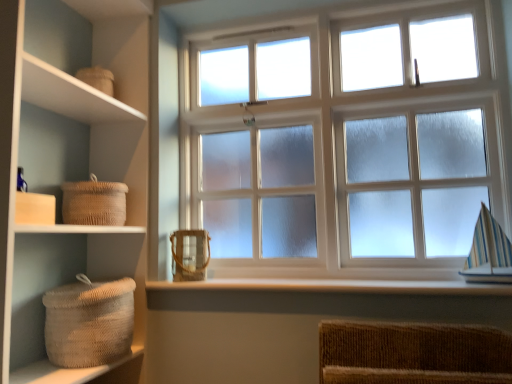
Describe the element at coordinates (94, 202) in the screenshot. I see `woven natural fiber basket at left, acting as the 3th basket starting from the bottom` at that location.

In order to face woven natural fiber basket at left, which is the 1th basket from top to bottom, should I rotate leftwards or rightwards?

Rotate your view left by about 20.331°.

What do you see at coordinates (67, 173) in the screenshot? This screenshot has width=512, height=384. I see `beige woven basket at left` at bounding box center [67, 173].

At what (x,y) coordinates should I click in order to perform the action: click on frosted glass window at center. Please return your answer as a coordinate pair (x, y). This screenshot has width=512, height=384. Looking at the image, I should click on (354, 146).

Consider the image. Considering the sizes of objects brown woven basket at center, which is the second basket from top to bottom, and white smooth wood at lower center in the image provided, who is smaller, brown woven basket at center, which is the second basket from top to bottom, or white smooth wood at lower center?

With smaller size is brown woven basket at center, which is the second basket from top to bottom.

From a real-world perspective, who is located lower, brown woven basket at center, which is counted as the second basket, starting from the bottom, or white smooth wood at lower center?

white smooth wood at lower center, from a real-world perspective.

Could you tell me if brown woven basket at center, which is the second basket from top to bottom, is facing white smooth wood at lower center?

No, brown woven basket at center, which is the second basket from top to bottom, is not aimed at white smooth wood at lower center.

Which is more to the right, brown woven basket at center, which is counted as the second basket, starting from the bottom, or white smooth wood at lower center?

From the viewer's perspective, white smooth wood at lower center appears more on the right side.

Considering the relative sizes of beige woven basket at left and brown woven basket at center, which is the second basket from top to bottom, in the image provided, is beige woven basket at left shorter than brown woven basket at center, which is the second basket from top to bottom,?

No, beige woven basket at left is not shorter than brown woven basket at center, which is the second basket from top to bottom.

Are beige woven basket at left and brown woven basket at center, which is the second basket from top to bottom, located far from each other?

beige woven basket at left is near brown woven basket at center, which is the second basket from top to bottom, not far away.

From the image's perspective, is beige woven basket at left over brown woven basket at center, which is counted as the second basket, starting from the bottom?

Yes, from the image's perspective, beige woven basket at left is over brown woven basket at center, which is counted as the second basket, starting from the bottom.

In the scene shown: Is beige woven basket at left to the right of brown woven basket at center, which is counted as the second basket, starting from the bottom, from the viewer's perspective?

In fact, beige woven basket at left is to the left of brown woven basket at center, which is counted as the second basket, starting from the bottom.

In terms of width, does brown woven basket at center, which is counted as the second basket, starting from the bottom, look wider or thinner when compared to beige woven basket at left?

In the image, brown woven basket at center, which is counted as the second basket, starting from the bottom, appears to be more narrow than beige woven basket at left.

Is there a large distance between brown woven basket at center, which is counted as the second basket, starting from the bottom, and beige woven basket at left?

No, there isn't a large distance between brown woven basket at center, which is counted as the second basket, starting from the bottom, and beige woven basket at left.

Which is more to the right, brown woven basket at center, which is the second basket from top to bottom, or beige woven basket at left?

brown woven basket at center, which is the second basket from top to bottom, is more to the right.

How many degrees apart are the facing directions of woven natural fiber basket at left, acting as the 3th basket starting from the bottom, and white smooth wood at lower center?

88.7 degrees separate the facing orientations of woven natural fiber basket at left, acting as the 3th basket starting from the bottom, and white smooth wood at lower center.

Is woven natural fiber basket at left, which is the 1th basket from top to bottom, oriented towards white smooth wood at lower center?

Yes, woven natural fiber basket at left, which is the 1th basket from top to bottom, is aimed at white smooth wood at lower center.

Is woven natural fiber basket at left, acting as the 3th basket starting from the bottom, not inside white smooth wood at lower center?

Indeed, woven natural fiber basket at left, acting as the 3th basket starting from the bottom, is completely outside white smooth wood at lower center.

Are woven natural fiber basket at left, which is the 1th basket from top to bottom, and white smooth wood at lower center beside each other?

No, woven natural fiber basket at left, which is the 1th basket from top to bottom, is not beside white smooth wood at lower center.

Is white smooth wood at lower center not close to woven natural fiber basket at left, acting as the 3th basket starting from the bottom?

No, white smooth wood at lower center is not far from woven natural fiber basket at left, acting as the 3th basket starting from the bottom.

Does white smooth wood at lower center have a larger size compared to woven natural fiber basket at left, which is the 1th basket from top to bottom?

Indeed, white smooth wood at lower center has a larger size compared to woven natural fiber basket at left, which is the 1th basket from top to bottom.

Considering the positions of objects white smooth wood at lower center and woven natural fiber basket at left, which is the 1th basket from top to bottom, in the image provided, who is more to the right, white smooth wood at lower center or woven natural fiber basket at left, which is the 1th basket from top to bottom,?

From the viewer's perspective, white smooth wood at lower center appears more on the right side.

Does white smooth wood at lower center have a greater height compared to woven natural fiber basket at left, acting as the 3th basket starting from the bottom?

No.

Considering the positions of points (108, 205) and (265, 40), is point (108, 205) closer to camera compared to point (265, 40)?

Yes, it is in front of point (265, 40).

In the scene shown: How much distance is there between woven natural fiber basket at left, which is the 1th basket from top to bottom, and frosted glass window at center?

They are 32.81 inches apart.

Is woven natural fiber basket at left, which is the 1th basket from top to bottom, bigger than frosted glass window at center?

No, woven natural fiber basket at left, which is the 1th basket from top to bottom, is not bigger than frosted glass window at center.

Would you say woven natural fiber basket at left, acting as the 3th basket starting from the bottom, is to the left or to the right of frosted glass window at center in the picture?

Based on their positions, woven natural fiber basket at left, acting as the 3th basket starting from the bottom, is located to the left of frosted glass window at center.

Could you tell me if woven beige basket at lower left, the 3th basket when ordered from top to bottom, is facing frosted glass window at center?

No, woven beige basket at lower left, the 3th basket when ordered from top to bottom, is not facing towards frosted glass window at center.

From the image's perspective, does woven beige basket at lower left, the 3th basket when ordered from top to bottom, appear lower than frosted glass window at center?

Yes, from the image's perspective, woven beige basket at lower left, the 3th basket when ordered from top to bottom, is beneath frosted glass window at center.

Is woven beige basket at lower left, the 3th basket when ordered from top to bottom, at the left side of frosted glass window at center?

Yes.

From the frosted glass window at center, count the 2nd basket to the left and point to it. Please provide its 2D coordinates.

[(89, 322)]

The image size is (512, 384). Find the location of `the 1st basket above the white smooth wood at lower center (from the image's perspective)`. the 1st basket above the white smooth wood at lower center (from the image's perspective) is located at coordinates (190, 254).

Locate an element on the screen. The image size is (512, 384). the 3rd basket counting from the right of the beige woven basket at left is located at coordinates (190, 254).

Consider the image. From the image, which object appears to be farther from woven natural fiber basket at left, acting as the 3th basket starting from the bottom, woven beige basket at lower left, the 3th basket when ordered from top to bottom, or frosted glass window at center?

frosted glass window at center is positioned further to the anchor woven natural fiber basket at left, acting as the 3th basket starting from the bottom.

Consider the image. Looking at the image, which one is located further to woven natural fiber basket at left, which is the 1th basket from top to bottom, white smooth wood at lower center or brown woven basket at center, which is the second basket from top to bottom?

white smooth wood at lower center lies further to woven natural fiber basket at left, which is the 1th basket from top to bottom, than the other object.

Based on their spatial positions, is white smooth wood at lower center or woven natural fiber basket at left, acting as the 3th basket starting from the bottom, further from beige woven basket at left?

The object further to beige woven basket at left is white smooth wood at lower center.

Which object lies nearer to the anchor point beige woven basket at left, woven beige basket at lower left, the first basket in the bottom-to-top sequence, or white smooth wood at lower center?

Based on the image, woven beige basket at lower left, the first basket in the bottom-to-top sequence, appears to be nearer to beige woven basket at left.

Looking at the image, which one is located further to brown woven basket at center, which is counted as the second basket, starting from the bottom, woven natural fiber basket at left, which is the 1th basket from top to bottom, or frosted glass window at center?

frosted glass window at center is positioned further to the anchor brown woven basket at center, which is counted as the second basket, starting from the bottom.

Estimate the real-world distances between objects in this image. Which object is further from woven natural fiber basket at left, acting as the 3th basket starting from the bottom, beige woven basket at left or woven beige basket at lower left, the first basket in the bottom-to-top sequence?

woven beige basket at lower left, the first basket in the bottom-to-top sequence, is further to woven natural fiber basket at left, acting as the 3th basket starting from the bottom.

Based on their spatial positions, is frosted glass window at center or white smooth wood at lower center closer to brown woven basket at center, which is counted as the second basket, starting from the bottom?

Based on the image, white smooth wood at lower center appears to be nearer to brown woven basket at center, which is counted as the second basket, starting from the bottom.

Which object lies nearer to the anchor point brown woven basket at center, which is the second basket from top to bottom, white smooth wood at lower center or woven natural fiber basket at left, which is the 1th basket from top to bottom?

Among the two, white smooth wood at lower center is located nearer to brown woven basket at center, which is the second basket from top to bottom.

The width and height of the screenshot is (512, 384). In order to click on window sill located between brown woven basket at center, which is the second basket from top to bottom, and frosted glass window at center in the left-right direction in this screenshot , I will do `click(334, 287)`.

At what (x,y) coordinates should I click in order to perform the action: click on basket between woven natural fiber basket at left, which is the 1th basket from top to bottom, and woven beige basket at lower left, the first basket in the bottom-to-top sequence, in the vertical direction. Please return your answer as a coordinate pair (x, y). This screenshot has height=384, width=512. Looking at the image, I should click on (190, 254).

Image resolution: width=512 pixels, height=384 pixels. What are the coordinates of `window sill between woven beige basket at lower left, the first basket in the bottom-to-top sequence, and frosted glass window at center from left to right` in the screenshot? It's located at (334, 287).

The image size is (512, 384). Find the location of `basket between woven beige basket at lower left, the 3th basket when ordered from top to bottom, and frosted glass window at center`. basket between woven beige basket at lower left, the 3th basket when ordered from top to bottom, and frosted glass window at center is located at coordinates (190, 254).